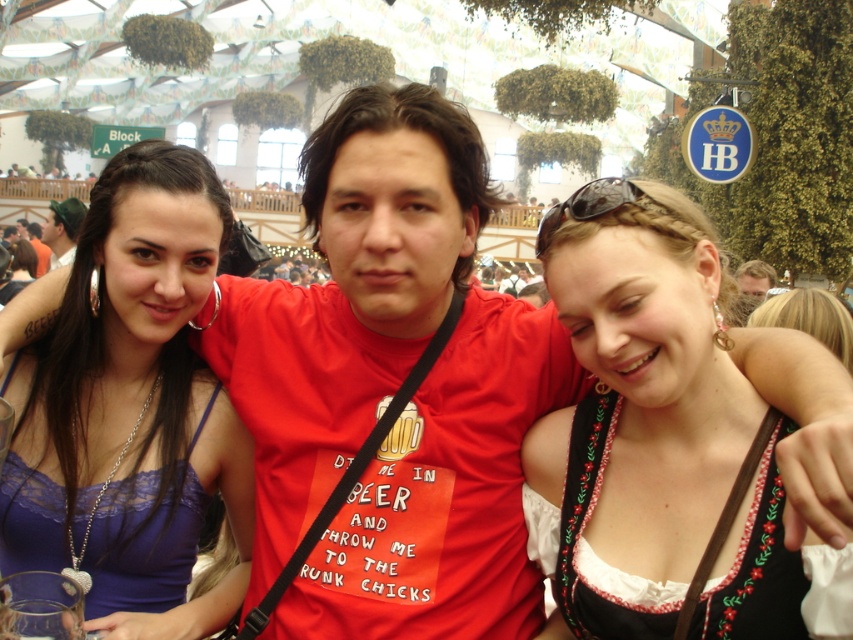
Can you confirm if matte purple dress at center is bigger than light brown hair at center?

Correct, matte purple dress at center is larger in size than light brown hair at center.

Does matte purple dress at center come in front of light brown hair at center?

That is True.

Find the location of a particular element. matte purple dress at center is located at coordinates (131, 406).

This screenshot has width=853, height=640. Describe the element at coordinates (131, 406) in the screenshot. I see `matte purple dress at center` at that location.

Is point (97, 218) closer to camera compared to point (770, 464)?

No, (97, 218) is behind (770, 464).

The height and width of the screenshot is (640, 853). I want to click on matte purple dress at center, so click(131, 406).

Which of these two, matte black hair at left or light brown hair at center, stands taller?

With more height is matte black hair at left.

Can you confirm if matte black hair at left is wider than light brown hair at center?

Yes, matte black hair at left is wider than light brown hair at center.

Does point (80, 212) lie behind point (772, 269)?

Yes, point (80, 212) is farther from viewer.

Locate an element on the screen. This screenshot has width=853, height=640. matte black hair at left is located at coordinates (62, 228).